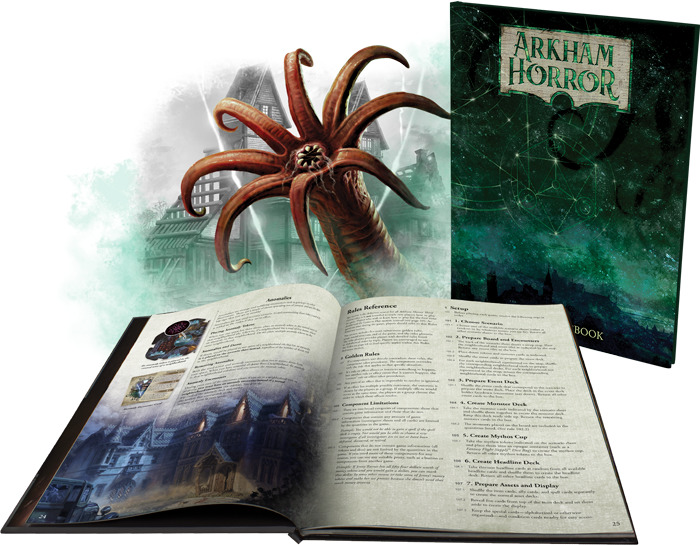
The image size is (700, 545). I want to click on book, so click(x=556, y=187), click(x=392, y=409), click(x=194, y=411).